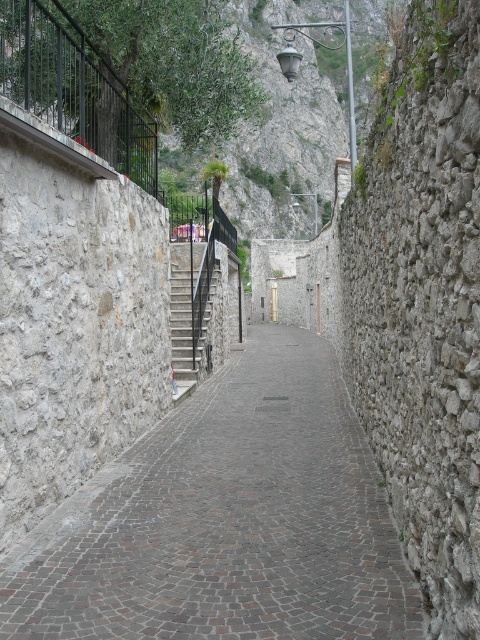
You are a delivery person carrying a large package and need to navigate through the narrow cobblestone street. There is a brown cobblestone pavement at center and dark gray stone stairs at center in your path. Which path should you choose to ensure your package won

The brown cobblestone pavement at center is wider than the dark gray stone stairs at center, so you should choose the brown cobblestone pavement at center to ensure your package can pass safely.

You are a delivery person carrying a heavy box and need to navigate the narrow cobblestone street. You notice the brown cobblestone pavement at center and the black metal railing at upper left. Which object is shorter in height?

The brown cobblestone pavement at center is shorter than the black metal railing at upper left.